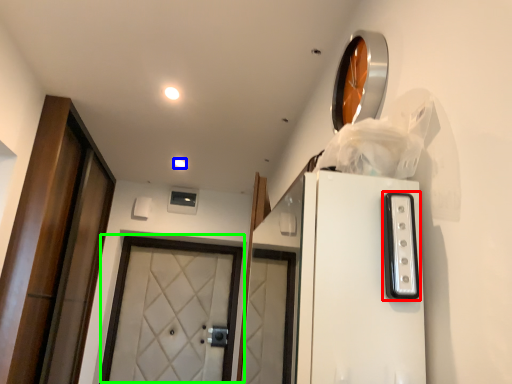
Question: Which object is the closest to the appliance (highlighted by a red box)? Choose among these: lighting (highlighted by a blue box) or door (highlighted by a green box).

Choices:
 (A) lighting
 (B) door

Answer: (A)